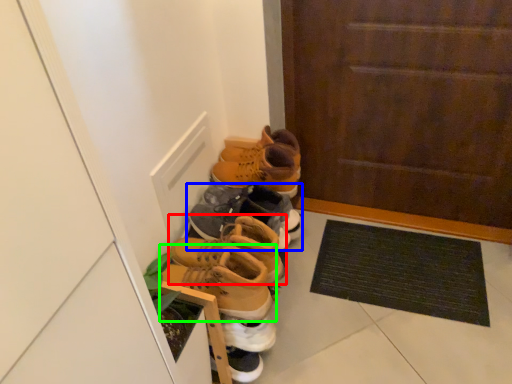
Question: Considering the real-world distances, which object is farthest from footwear (highlighted by a red box)? footwear (highlighted by a blue box) or footwear (highlighted by a green box)?

Choices:
 (A) footwear
 (B) footwear

Answer: (A)